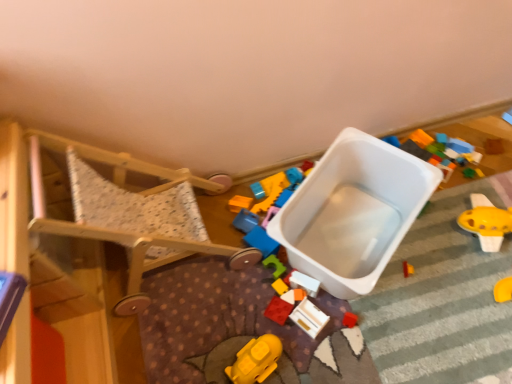
Where is `free space in front of wooden walker at left`? The width and height of the screenshot is (512, 384). free space in front of wooden walker at left is located at coordinates (203, 331).